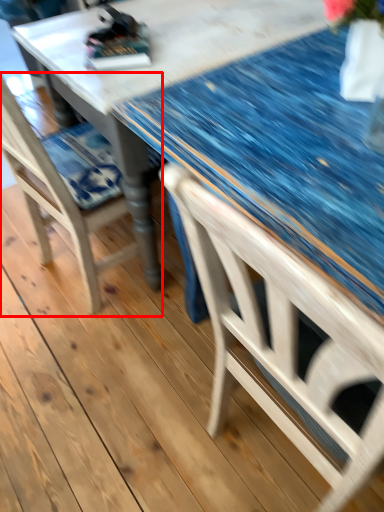
Question: In this image, where is chair (annotated by the red box) located relative to glass table?

Choices:
 (A) left
 (B) right

Answer: (A)